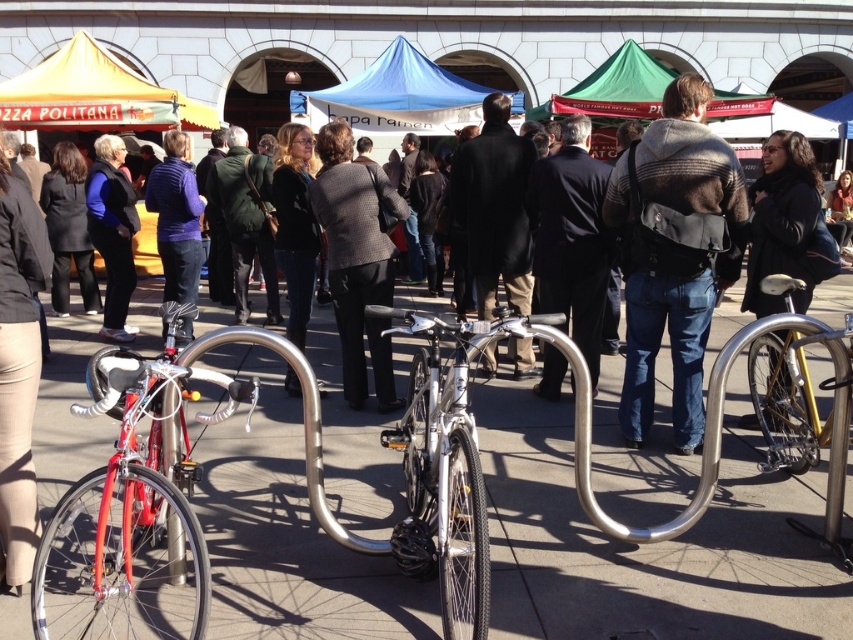
You are standing in the outdoor scene and want to pick up an item from the center area. Which item is easier to reach without moving your position, the dark gray sweater at center or the matte black jacket at center?

The dark gray sweater at center is closer to the viewer than the matte black jacket at center, so it is easier to reach without moving your position.

You are standing in the outdoor scene and see the dark gray sweater at center and the green wool coat at center. Which clothing item is positioned more to the left?

The green wool coat at center is positioned more to the left because the dark gray sweater at center is to the right of it.

You are standing in the outdoor scene and want to take a photo of both point (x=538, y=232) and point (x=161, y=124). Which point should you focus on first to ensure both are in focus?

You should focus on point (x=538, y=232) first because it is closer to the camera than point (x=161, y=124), ensuring the depth of field captures both points.